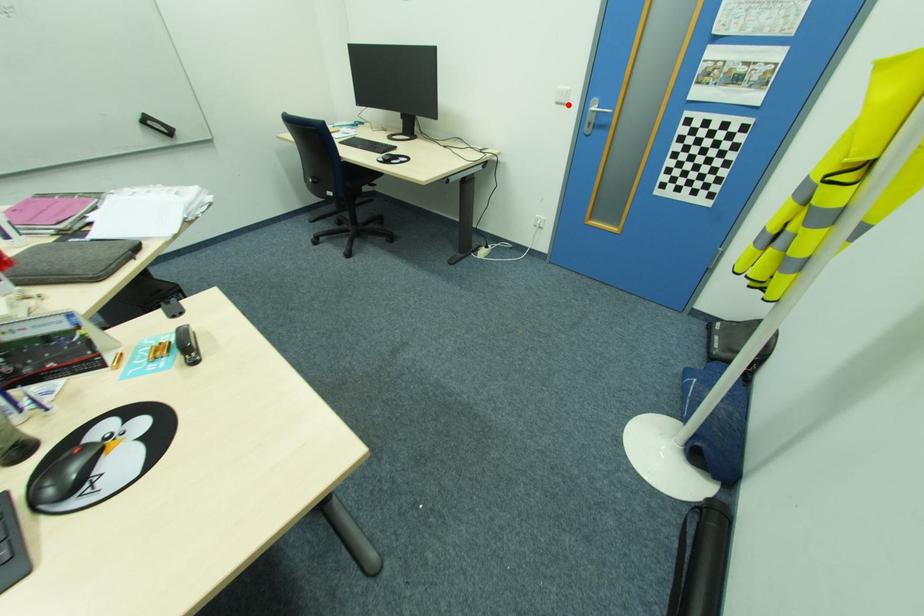
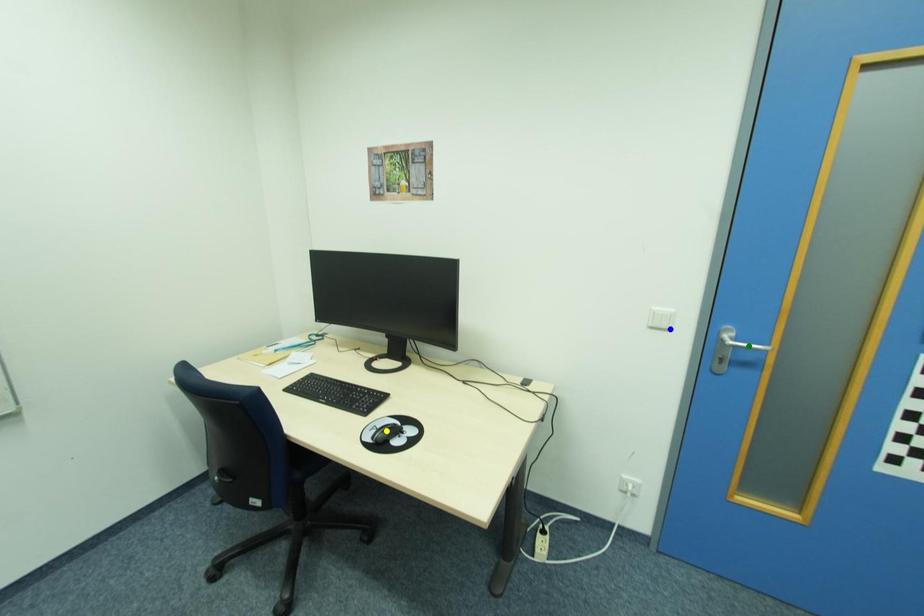
Question: I am providing you with two images of the same scene from different viewpoints. A red point is marked on the first image. You are given multiple points on the second image. Which point in image 2 represents the same 3d spot as the red point in image 1?

Choices:
 (A) green point
 (B) blue point
 (C) yellow point

Answer: (B)